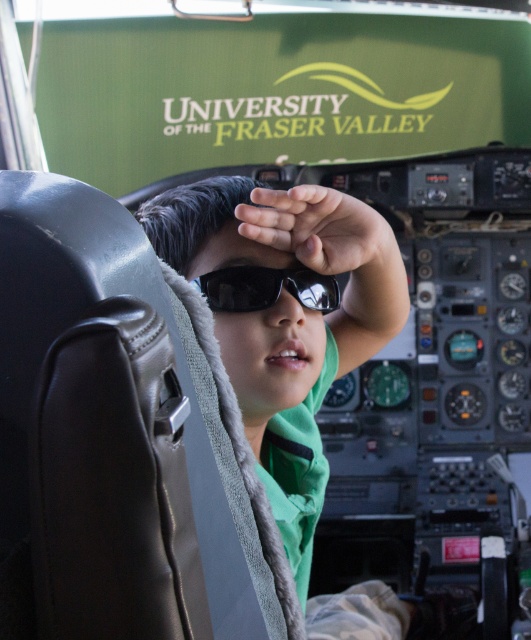
Question: Which point is farther to the camera?

Choices:
 (A) (335, 328)
 (B) (307, 292)

Answer: (A)

Question: Which point is closer to the camera taking this photo?

Choices:
 (A) (204, 292)
 (B) (354, 205)

Answer: (B)

Question: Can you confirm if green fabric at center is thinner than black reflective sunglasses at center?

Choices:
 (A) no
 (B) yes

Answer: (A)

Question: Which point appears farthest from the camera in this image?

Choices:
 (A) (396, 282)
 (B) (328, 300)

Answer: (A)

Question: Is green fabric at center wider than black reflective sunglasses at center?

Choices:
 (A) no
 (B) yes

Answer: (B)

Question: Does green fabric at center have a larger size compared to black reflective sunglasses at center?

Choices:
 (A) yes
 (B) no

Answer: (A)